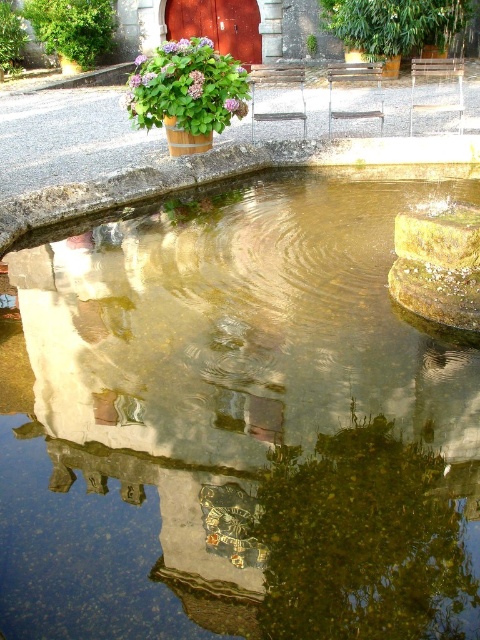
You are standing at the edge of the pond and want to place a small statue between the clear water at center and the green bamboo at upper right. Which object should you place it closer to if you want the statue to be more visible in the reflection of the water?

The clear water at center is bigger than the green bamboo at upper right, so placing the statue closer to the clear water at center would make it more visible in the reflection since the water area is larger.

You are standing at the edge of the pond and want to walk towards the point labeled as point (x=398, y=54). However, there is an obstacle at point labeled as point (x=342, y=310). Will you encounter this obstacle before reaching your destination?

Yes, you will encounter the obstacle at point (x=342, y=310) before reaching point (x=398, y=54) because point (x=342, y=310) is in front of point (x=398, y=54).

You are standing at the center of the pond looking out. Which object is positioned to the right of the other between the green bamboo at upper right and the green leafy tree at upper left?

The green bamboo at upper right is positioned to the right of the green leafy tree at upper left.